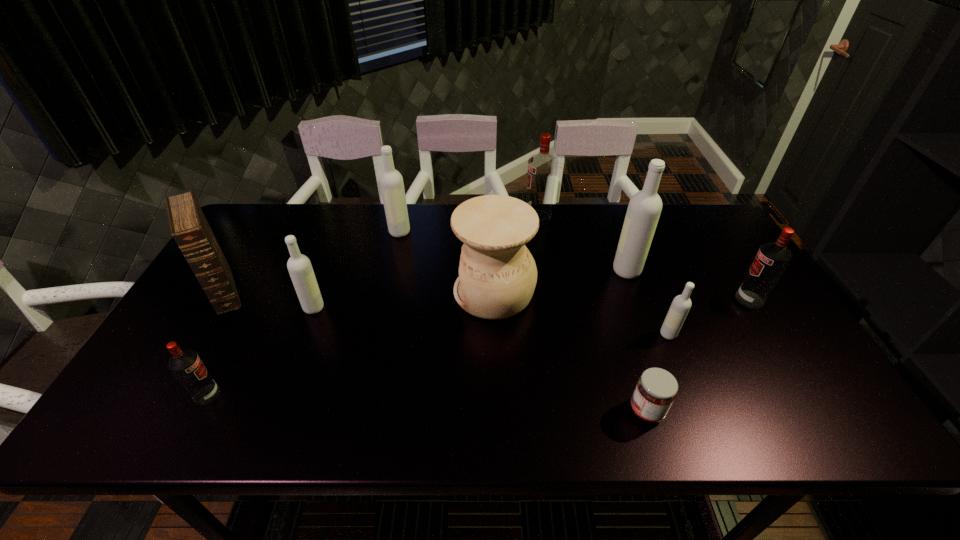
The width and height of the screenshot is (960, 540). Identify the location of vacant position located on the front label of the second farthest red vodka. (700, 299).

Where is `blank area located on the front label of the smallest red vodka`? Image resolution: width=960 pixels, height=540 pixels. blank area located on the front label of the smallest red vodka is located at coordinates [x=259, y=395].

Identify the location of vacant space situated on the back of the eighth farthest object. The width and height of the screenshot is (960, 540). (636, 254).

Where is `free region located on the right of the shortest object`? The image size is (960, 540). free region located on the right of the shortest object is located at coordinates (723, 410).

Find the location of a particular element. vodka present at the near edge is located at coordinates (186, 365).

Identify the location of jam present at the near edge. Image resolution: width=960 pixels, height=540 pixels. (656, 389).

At what (x,y) coordinates should I click in order to perform the action: click on Bible present at the left edge. Please return your answer as a coordinate pair (x, y). This screenshot has height=540, width=960. Looking at the image, I should click on (188, 224).

At what (x,y) coordinates should I click in order to perform the action: click on vodka that is at the left edge. Please return your answer as a coordinate pair (x, y). This screenshot has height=540, width=960. Looking at the image, I should click on (186, 365).

You are a GUI agent. You are given a task and a screenshot of the screen. Output one action in this format:
    pyautogui.click(x=<x>, y=<y>)
    Task: Click on the object that is at the right edge
    
    Given the screenshot: What is the action you would take?
    pyautogui.click(x=772, y=259)

Find the location of a particular element. The image size is (960, 540). object that is at the near left corner is located at coordinates (186, 365).